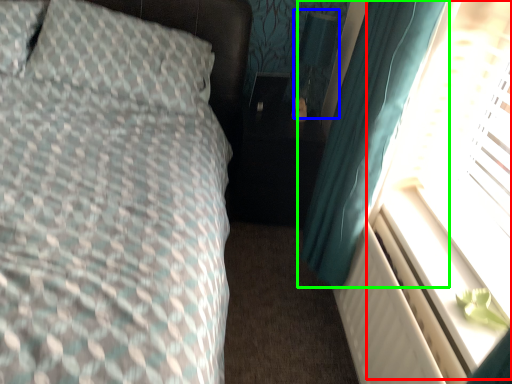
Question: Which object is the closest to the window screen (highlighted by a red box)? Choose among these: table lamp (highlighted by a blue box) or curtain (highlighted by a green box).

Choices:
 (A) table lamp
 (B) curtain

Answer: (B)